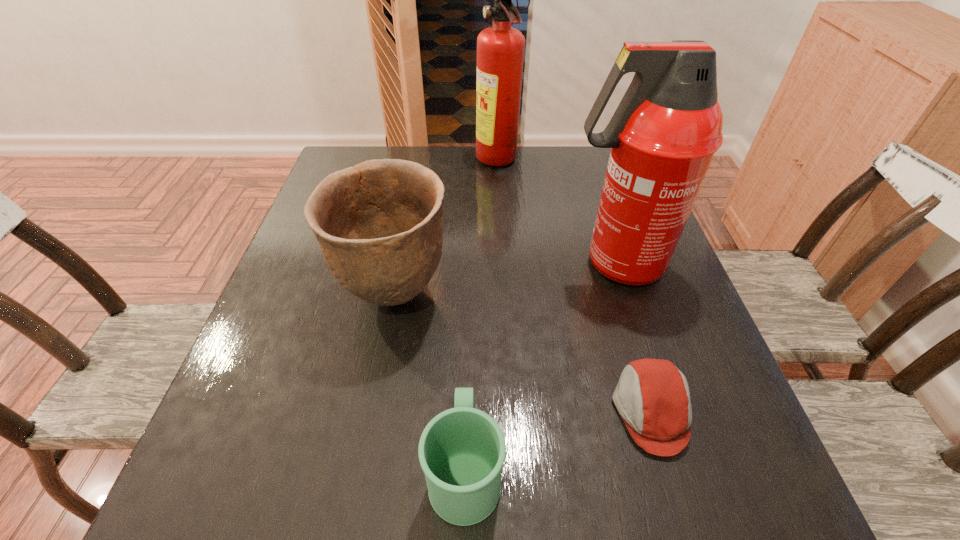
The width and height of the screenshot is (960, 540). What are the coordinates of `vacant space located on the trigger side of the right fire extinguisher` in the screenshot? It's located at (450, 264).

Identify the location of vacant area situated 0.290m on the trigger side of the right fire extinguisher. (433, 264).

This screenshot has width=960, height=540. In order to click on free space located on the back of the pottery in this screenshot , I will do `click(413, 198)`.

Locate an element on the screen. Image resolution: width=960 pixels, height=540 pixels. blank space located 0.400m on the side of the fourth tallest object with the handle is located at coordinates (470, 255).

Where is `free space located 0.290m on the side of the fourth tallest object with the handle`? This screenshot has width=960, height=540. free space located 0.290m on the side of the fourth tallest object with the handle is located at coordinates (469, 290).

Locate an element on the screen. The width and height of the screenshot is (960, 540). vacant position located 0.370m on the side of the fourth tallest object with the handle is located at coordinates (470, 264).

You are a GUI agent. You are given a task and a screenshot of the screen. Output one action in this format:
    pyautogui.click(x=<x>, y=<y>)
    Task: Click on the free location located 0.200m on the front-facing side of the shortest object
    This screenshot has width=960, height=540.
    Given the screenshot: What is the action you would take?
    pyautogui.click(x=493, y=411)

The height and width of the screenshot is (540, 960). I want to click on vacant space located on the front-facing side of the shortest object, so click(x=565, y=411).

The image size is (960, 540). Identify the location of blank space located 0.090m on the front-facing side of the shortest object. (560, 411).

Find the location of a particular element. object positioned at the far edge is located at coordinates (500, 49).